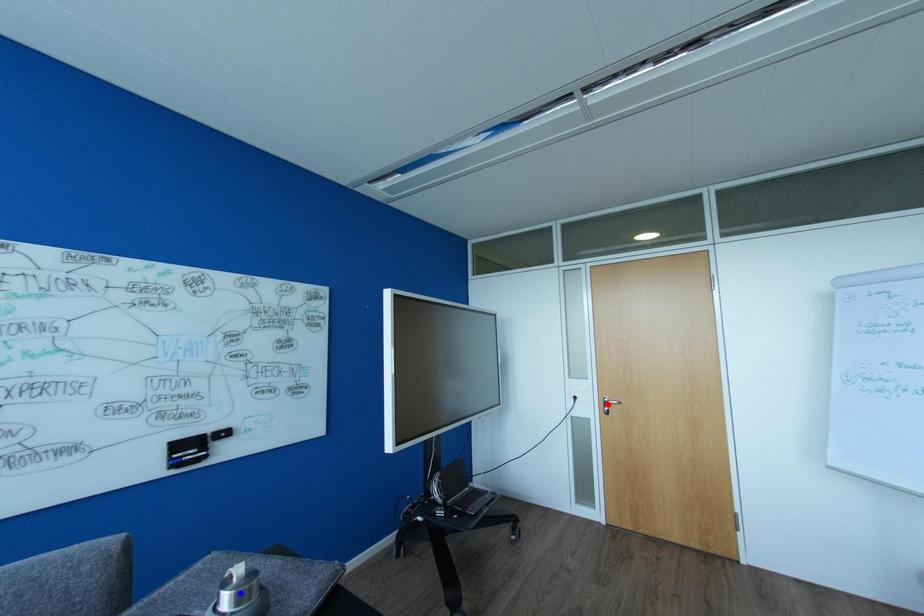
Question: In the image, two points are highlighted. Which point is nearer to the camera? Reply with the corresponding letter.

Choices:
 (A) blue point
 (B) red point

Answer: (A)